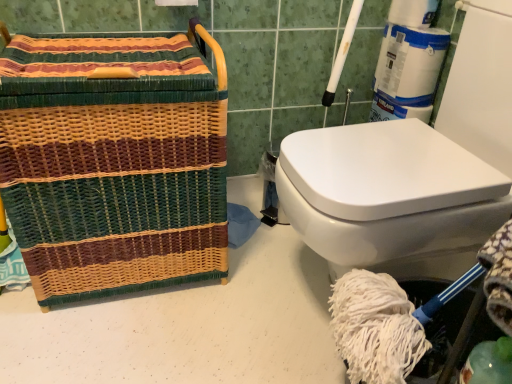
This screenshot has height=384, width=512. What are the coordinates of `free space in front of woven multicolored basket at left` in the screenshot? It's located at (118, 343).